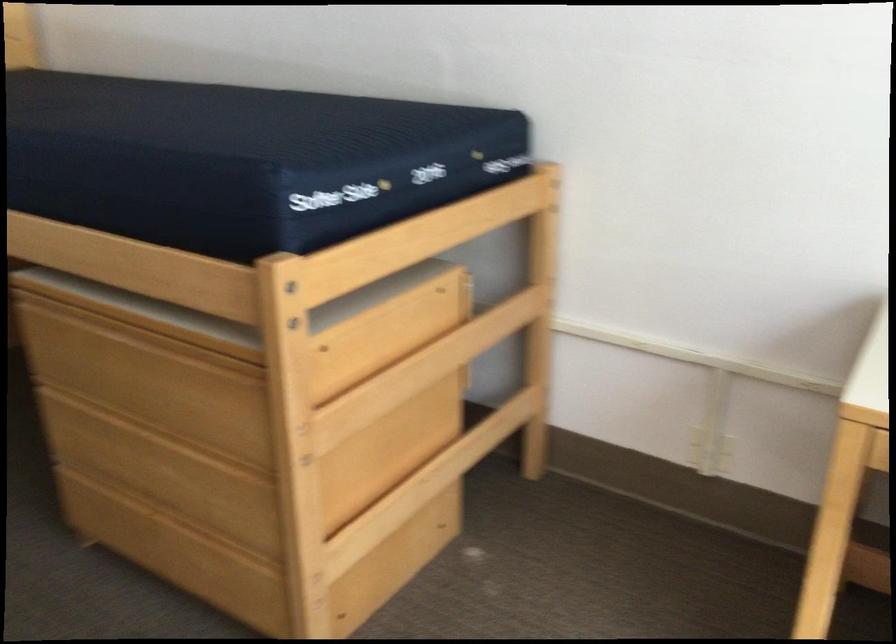
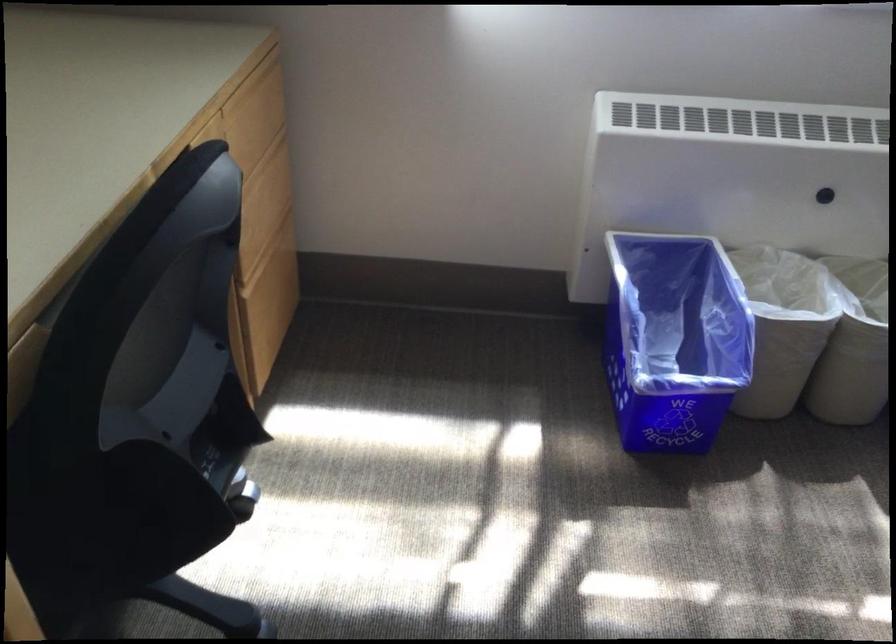
The images are taken continuously from a first-person perspective. In which direction is your viewpoint rotating?

The rotation direction of the camera is right-down.